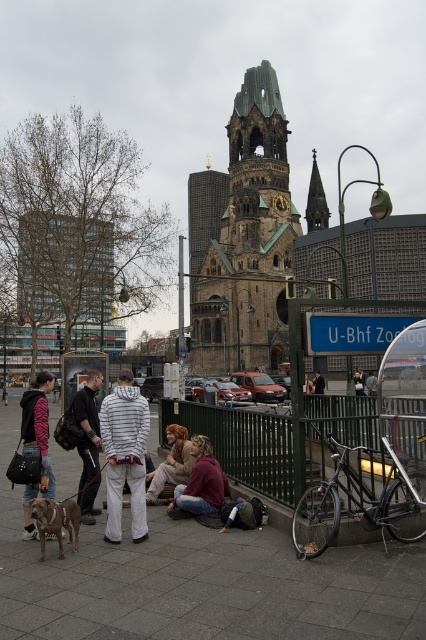
Question: Which of these objects is positioned closest to the brown hair at center?

Choices:
 (A) concrete pavement at center
 (B) green metal fence at lower center
 (C) dark gray hoodie at center

Answer: (C)

Question: Does white striped hoodie at center have a larger size compared to brown fur dog at lower left?

Choices:
 (A) yes
 (B) no

Answer: (A)

Question: Which point is closer to the camera?

Choices:
 (A) concrete pavement at center
 (B) jeans at center
 (C) green metal fence at lower center
 (D) dark gray hoodie at center

Answer: (A)

Question: From the image, what is the correct spatial relationship of concrete pavement at center in relation to white striped hoodie at center?

Choices:
 (A) above
 (B) below

Answer: (B)

Question: Which of the following is the farthest from the observer?

Choices:
 (A) white striped hoodie at center
 (B) zebra print hoodie at lower left
 (C) metallic bicycle at center
 (D) jeans at center

Answer: (D)

Question: Does metallic bicycle at center appear on the right side of brown hair at center?

Choices:
 (A) no
 (B) yes

Answer: (B)